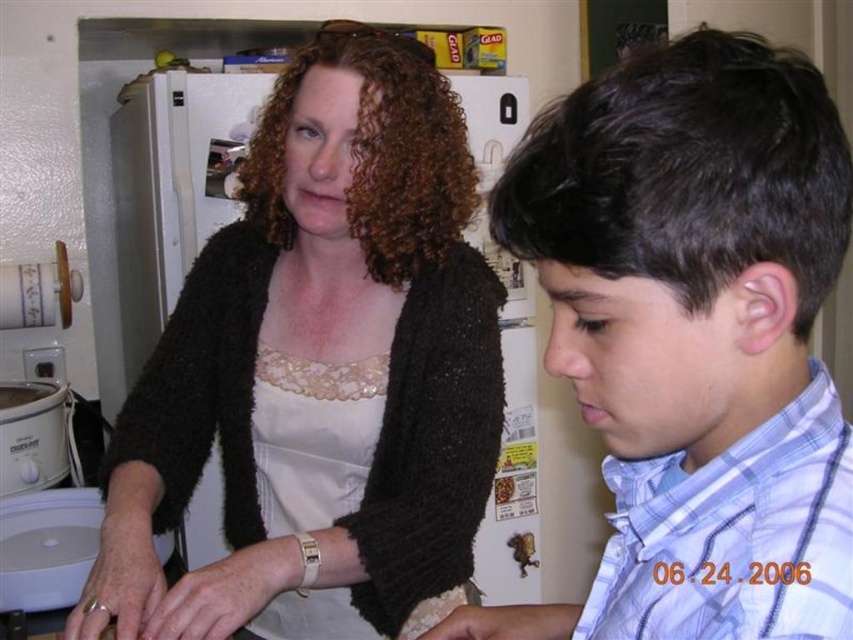
Can you confirm if black fuzzy sweater at upper left is positioned below blue plaid shirt at center?

Actually, black fuzzy sweater at upper left is above blue plaid shirt at center.

Does point (231, 248) come closer to viewer compared to point (844, 452)?

No, it is behind (844, 452).

This screenshot has width=853, height=640. I want to click on black fuzzy sweater at upper left, so click(x=318, y=372).